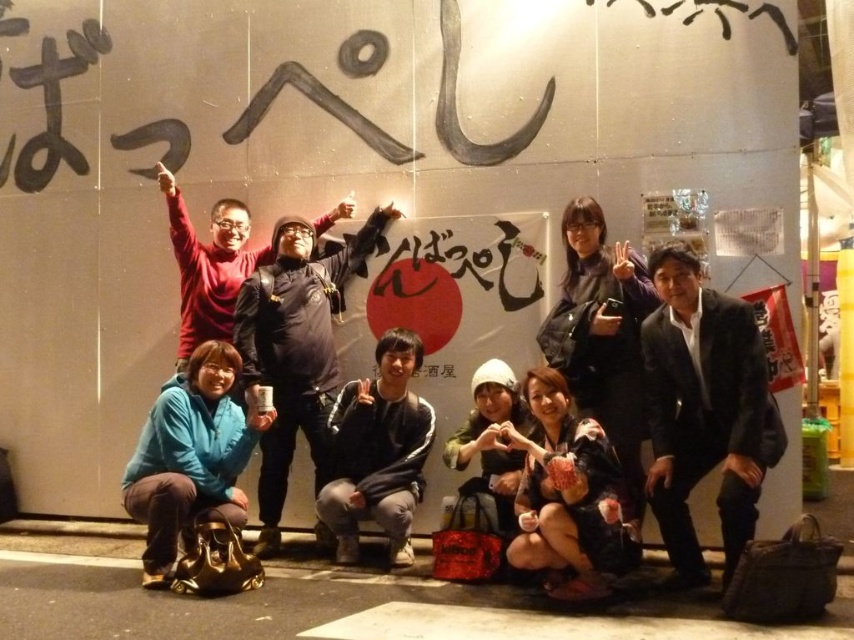
What is the spatial relationship between the dark blue jacket at center and the dark blue hoodie at center in the photo?

The dark blue jacket at center is positioned to the right of the dark blue hoodie at center.

You are a photographer trying to position a new subject in the exact center of the group photo. Given the current setup where the black suit at center is already placed at point 0.644 on the x and 0.826 on the y axis, where should you place the new subject to ensure they are centered?

The new subject should be placed at the exact center coordinates of the image, which is typically at point 0.5 on both the x and y axes. Since the black suit at center is currently at [705,412], moving the new subject to [427,320] would position them centrally.